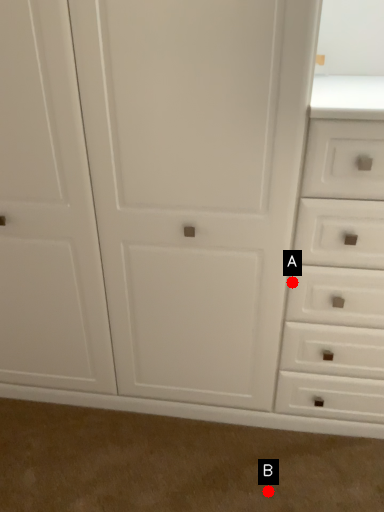
Question: Two points are circled on the image, labeled by A and B beside each circle. Which point appears farthest from the camera in this image?

Choices:
 (A) A is further
 (B) B is further

Answer: (B)